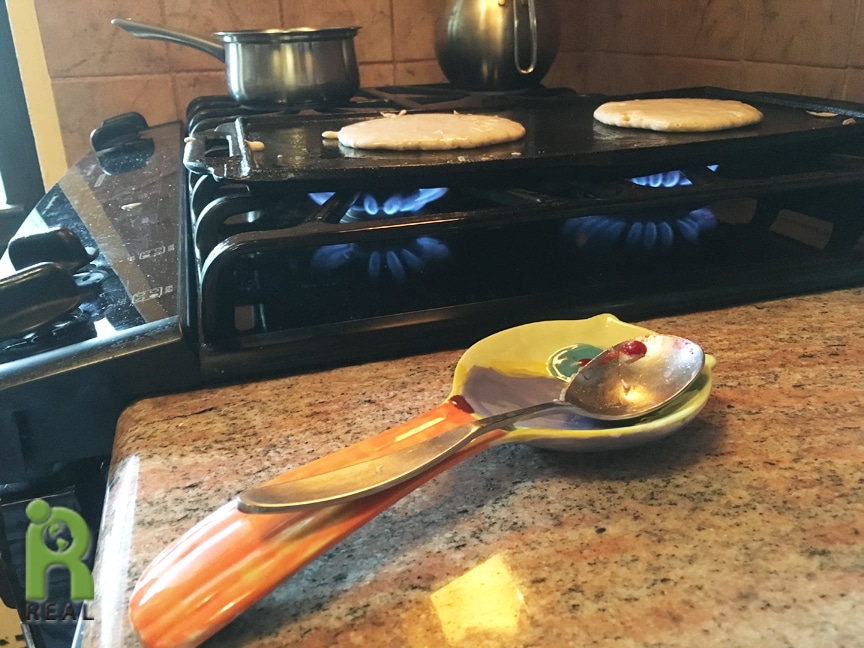
I want to click on stove, so pyautogui.click(x=147, y=218).